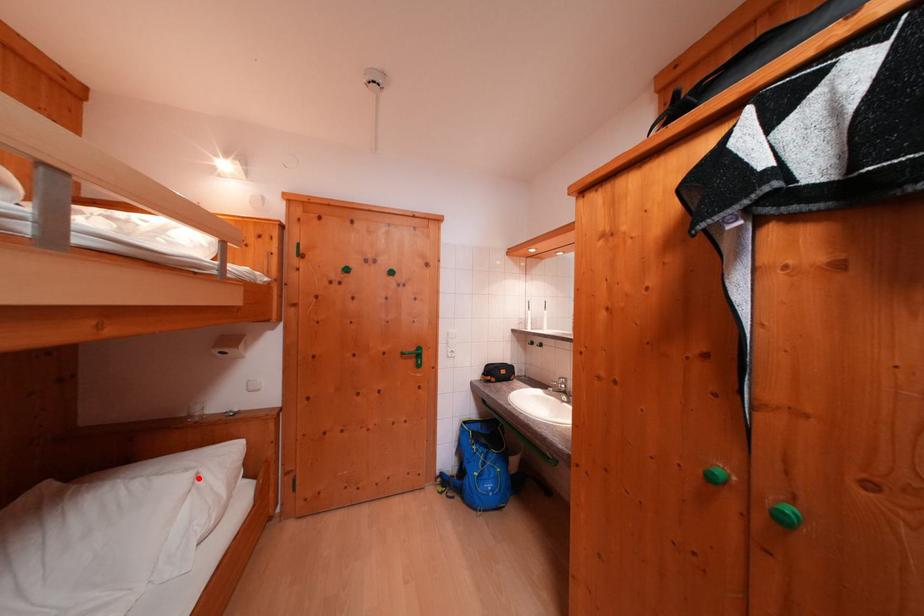
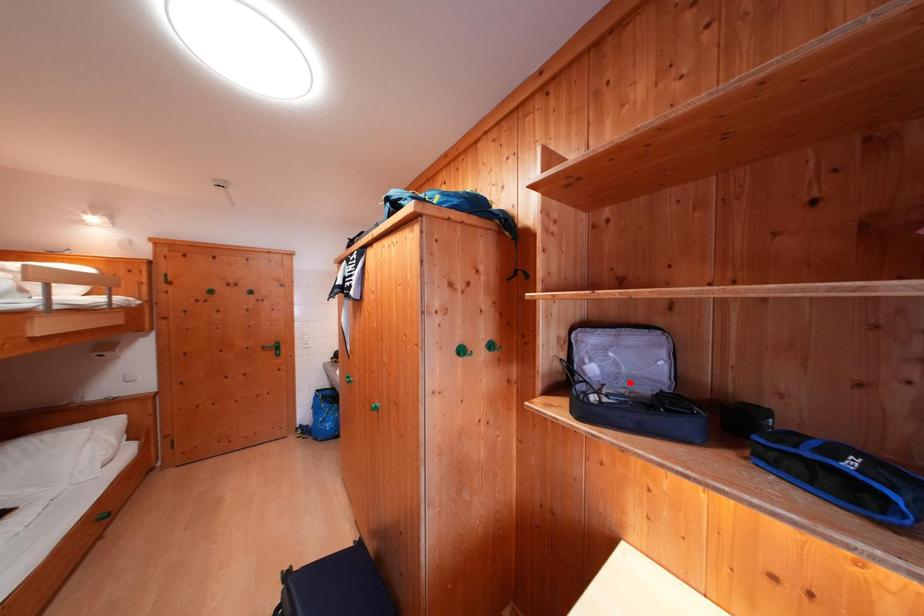
I am providing you with two images of the same scene from different viewpoints. A red point is marked on the first image and another point is marked on the second image. Is the marked point in image1 the same physical position as the marked point in image2?

No